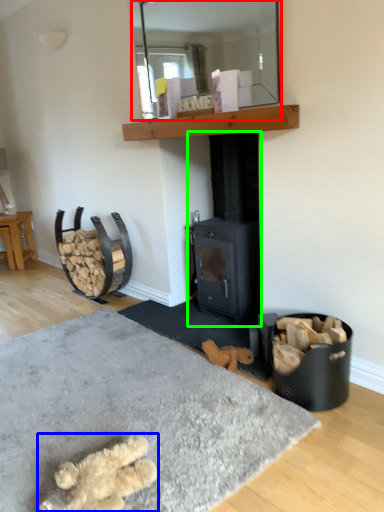
Question: Estimate the real-world distances between objects in this image. Which object is closer to mirror (highlighted by a red box), animal (highlighted by a blue box) or wood burning stove (highlighted by a green box)?

Choices:
 (A) animal
 (B) wood burning stove

Answer: (B)